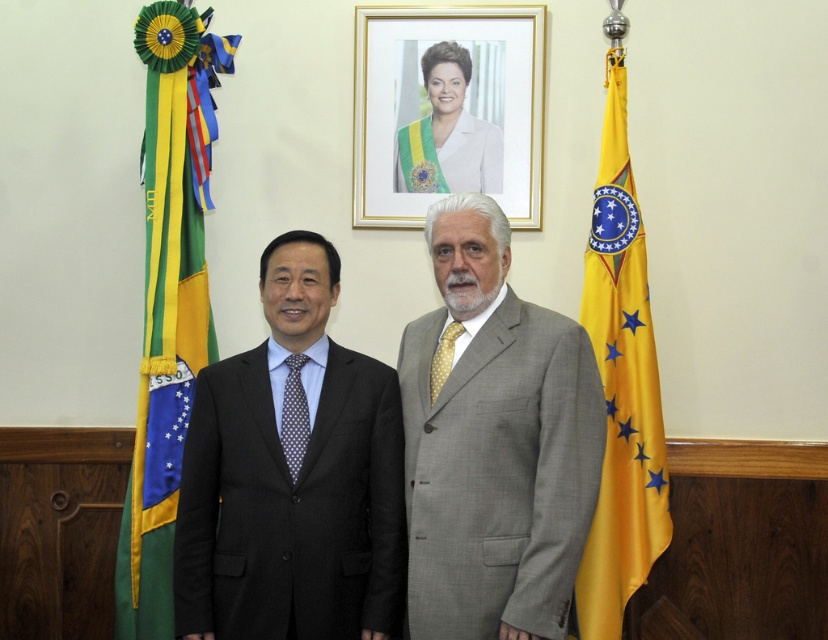
What do you see at coordinates (167, 298) in the screenshot? I see `green fabric flag at left` at bounding box center [167, 298].

Locate an element on the screen. This screenshot has height=640, width=828. green fabric flag at left is located at coordinates (167, 298).

Is green fabric flag at left wider than yellow fabric flag at right?

Indeed, green fabric flag at left has a greater width compared to yellow fabric flag at right.

Who is shorter, green fabric flag at left or yellow fabric flag at right?

yellow fabric flag at right is shorter.

Is point (190, 196) less distant than point (595, 547)?

No, it is behind (595, 547).

Where is `green fabric flag at left`? green fabric flag at left is located at coordinates (167, 298).

Where is `black pinstripe suit at center`? black pinstripe suit at center is located at coordinates (290, 480).

Which of these two, black pinstripe suit at center or gray wool suit at center, stands taller?

gray wool suit at center

Image resolution: width=828 pixels, height=640 pixels. What do you see at coordinates (290, 480) in the screenshot?
I see `black pinstripe suit at center` at bounding box center [290, 480].

Image resolution: width=828 pixels, height=640 pixels. What are the coordinates of `black pinstripe suit at center` in the screenshot? It's located at [290, 480].